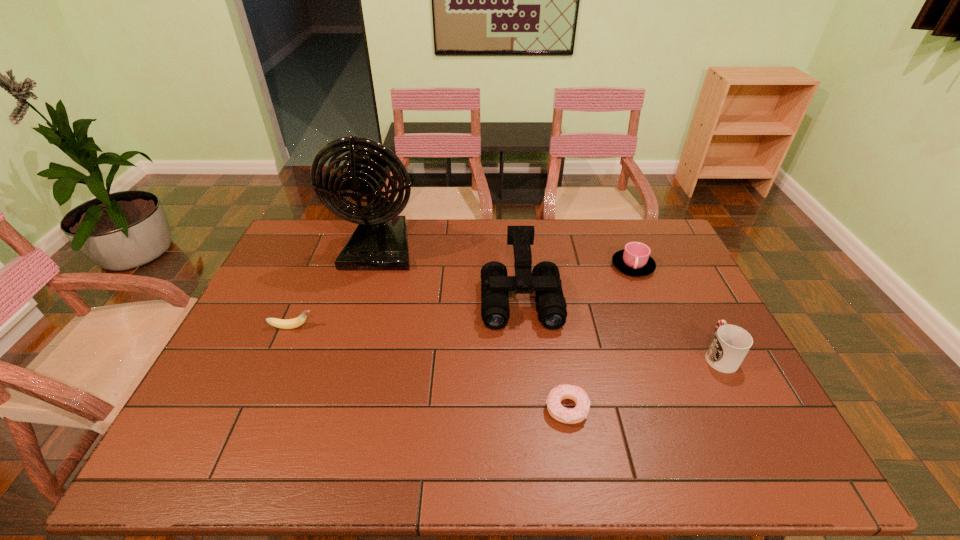
The height and width of the screenshot is (540, 960). In order to click on vacant area that satisfies the following two spatial constraints: 1. on the handle side of the third tallest object; 2. at the stem of the banana in this screenshot , I will do `click(705, 327)`.

I want to click on free space in the image that satisfies the following two spatial constraints: 1. on the front lenses of the binoculars; 2. at the stem of the banana, so click(x=523, y=327).

Find the location of a particular element. The height and width of the screenshot is (540, 960). vacant space that satisfies the following two spatial constraints: 1. in front of the tallest object to blow air; 2. at the stem of the banana is located at coordinates (358, 327).

Identify the location of free space in the image that satisfies the following two spatial constraints: 1. at the stem of the banana; 2. on the handle side of the fourth shortest object. (280, 355).

In order to click on free region that satisfies the following two spatial constraints: 1. at the stem of the banana; 2. on the handle side of the nearer cup in this screenshot , I will do `click(280, 355)`.

This screenshot has width=960, height=540. I want to click on free point that satisfies the following two spatial constraints: 1. on the front lenses of the nearest object; 2. on the right side of the second tallest object, so click(532, 409).